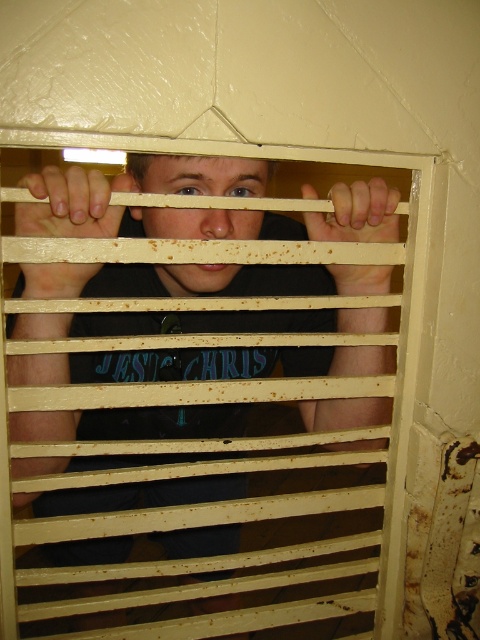
You are a security guard observing the scene. You notice the matte black shirt at center and the matte wood hand at left. How far apart are these two objects?

The matte black shirt at center is 11.50 inches from the matte wood hand at left, so they are 11.50 inches apart.

You are an observer looking at the scene. Can you see the matte black shirt at center through the space between the horizontal bars of the metal grate? Explain your reasoning based on the position of the matte wood hand at left.

The matte black shirt at center is located below the matte wood hand at left. Since the horizontal bars of the metal grate are evenly spaced, the shirt would be positioned lower than the hand. If the hand is blocking part of the shirt, the shirt might not be fully visible through the grate. However, the exact visibility depends on the spacing between the bars and the distance between the observer and the grate.

You are an observer looking at the image. You notice the matte black shirt at center and the brown wooden hand at center. Which object is wider?

The matte black shirt at center is wider than the brown wooden hand at center.